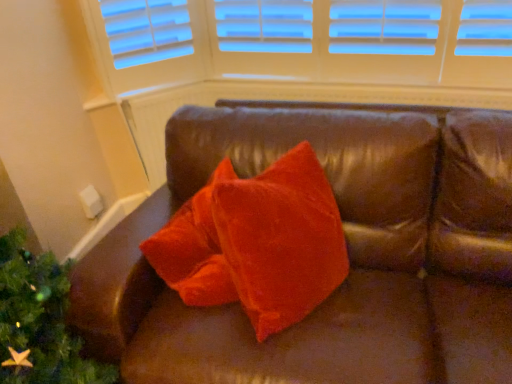
Measure the distance between point (449, 126) and camera.

Point (449, 126) is 4.36 feet from camera.

At what (x,y) coordinates should I click in order to perform the action: click on velvet orange pillow at center. Please return your answer as a coordinate pair (x, y). The image size is (512, 384). Looking at the image, I should click on (348, 252).

Image resolution: width=512 pixels, height=384 pixels. What do you see at coordinates (348, 252) in the screenshot?
I see `velvet orange pillow at center` at bounding box center [348, 252].

Locate an element on the screen. velvet orange pillow at center is located at coordinates (348, 252).